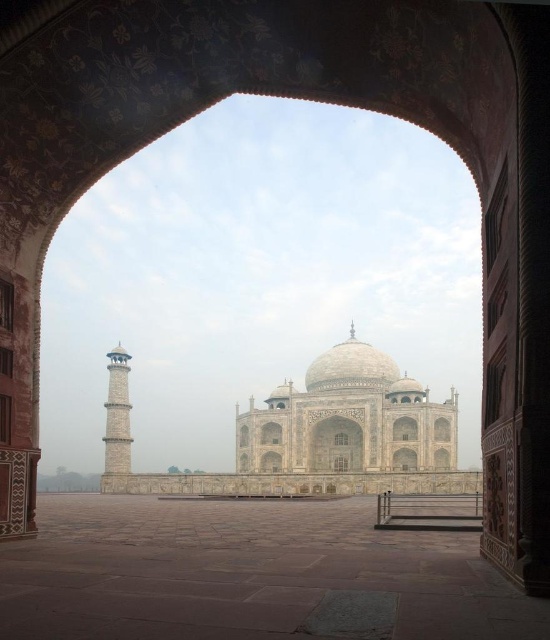
Question: Can you confirm if brown stone courtyard at center is positioned to the left of stone minaret at left?

Choices:
 (A) yes
 (B) no

Answer: (B)

Question: Which point appears farthest from the camera in this image?

Choices:
 (A) (x=121, y=390)
 (B) (x=490, y=595)

Answer: (A)

Question: Which of the following is the closest to the observer?

Choices:
 (A) (113, 440)
 (B) (154, 604)

Answer: (B)

Question: Is brown stone courtyard at center wider than stone minaret at left?

Choices:
 (A) yes
 (B) no

Answer: (A)

Question: Can you confirm if brown stone courtyard at center is positioned to the left of stone minaret at left?

Choices:
 (A) yes
 (B) no

Answer: (B)